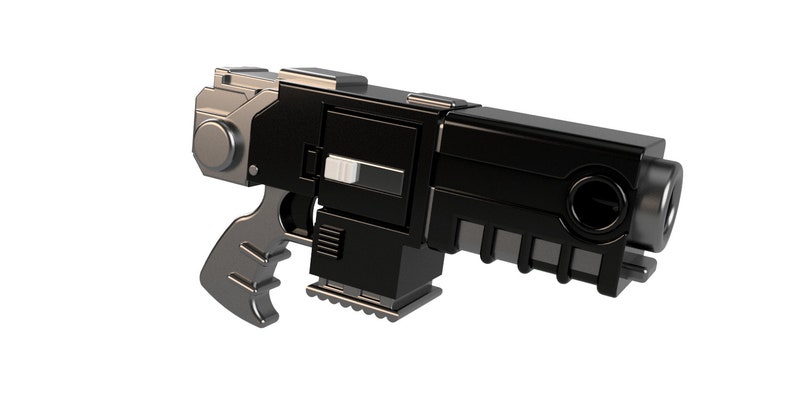
Find the location of `raised ridge on silver handle`. raised ridge on silver handle is located at coordinates (282, 257), (252, 255), (237, 284), (270, 285).